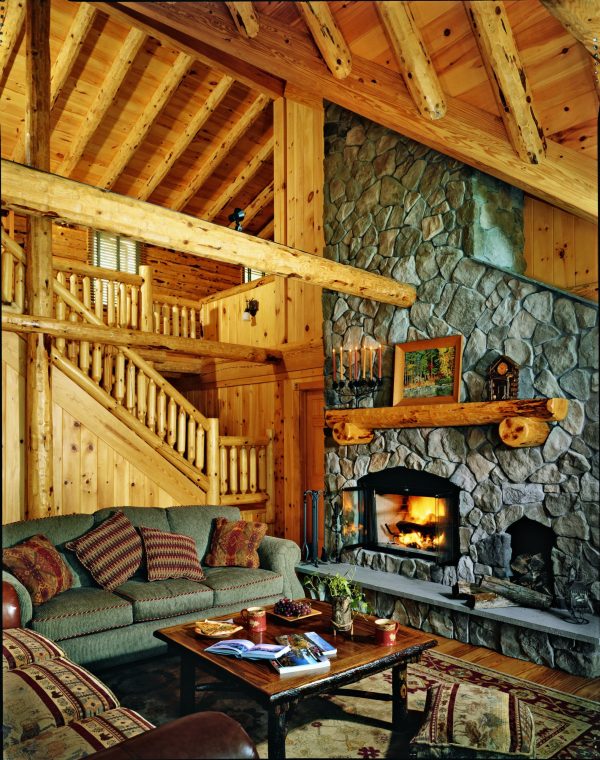
Image resolution: width=600 pixels, height=760 pixels. What are the coordinates of `yellow orange glowing fire in fireplace` in the screenshot? It's located at (419, 508), (417, 540).